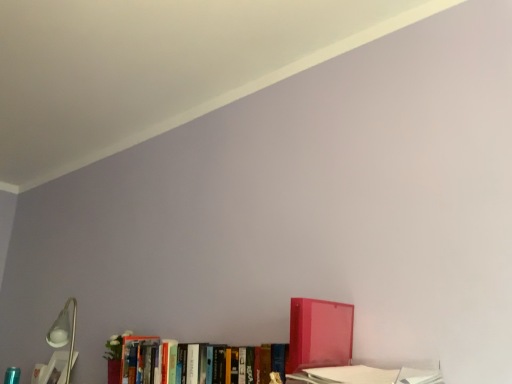
Question: Considering the relative sizes of translucent red binder at lower right, arranged as the first book when viewed from the right, and hardcover book at lower left, placed as the 1th book when sorted from back to front, in the image provided, is translucent red binder at lower right, arranged as the first book when viewed from the right, smaller than hardcover book at lower left, placed as the 1th book when sorted from back to front,?

Choices:
 (A) no
 (B) yes

Answer: (A)

Question: Is translucent red binder at lower right, the 1th book from the front, thinner than hardcover book at lower left, placed as the 1th book when sorted from back to front?

Choices:
 (A) yes
 (B) no

Answer: (B)

Question: Is translucent red binder at lower right, arranged as the first book when viewed from the right, positioned behind hardcover book at lower left, which is counted as the 3th book, starting from the right?

Choices:
 (A) no
 (B) yes

Answer: (A)

Question: Is translucent red binder at lower right, arranged as the first book when viewed from the right, wider than hardcover book at lower left, which is the 1th book in left-to-right order?

Choices:
 (A) yes
 (B) no

Answer: (A)

Question: Is translucent red binder at lower right, the 1th book from the front, not within hardcover book at lower left, which is the 1th book in left-to-right order?

Choices:
 (A) no
 (B) yes

Answer: (B)

Question: From a real-world perspective, is translucent red binder at lower right, which is the third book in back-to-front order, over hardcover book at lower left, placed as the 1th book when sorted from back to front?

Choices:
 (A) yes
 (B) no

Answer: (A)

Question: Considering the relative sizes of hardcover book at lower left, which is counted as the 3th book, starting from the front, and hardcover books at center, the second book in the right-to-left sequence, in the image provided, is hardcover book at lower left, which is counted as the 3th book, starting from the front, shorter than hardcover books at center, the second book in the right-to-left sequence,?

Choices:
 (A) yes
 (B) no

Answer: (B)

Question: Is hardcover book at lower left, which is counted as the 3th book, starting from the right, next to hardcover books at center, the second book in the right-to-left sequence?

Choices:
 (A) no
 (B) yes

Answer: (A)

Question: Is hardcover book at lower left, which is the 1th book in left-to-right order, located outside hardcover books at center, the second book in the right-to-left sequence?

Choices:
 (A) yes
 (B) no

Answer: (A)

Question: Could you tell me if hardcover book at lower left, placed as the 1th book when sorted from back to front, is turned towards hardcover books at center, which is the 2th book from back to front?

Choices:
 (A) yes
 (B) no

Answer: (B)

Question: From the image's perspective, is hardcover book at lower left, placed as the 1th book when sorted from back to front, below hardcover books at center, the 2th book from the front?

Choices:
 (A) yes
 (B) no

Answer: (A)

Question: Does hardcover book at lower left, placed as the 1th book when sorted from back to front, have a lesser width compared to hardcover books at center, which is the 2th book from back to front?

Choices:
 (A) yes
 (B) no

Answer: (A)

Question: Is translucent red binder at lower right, which is the third book in back-to-front order, positioned behind hardcover books at center, the 2th book from the front?

Choices:
 (A) yes
 (B) no

Answer: (B)